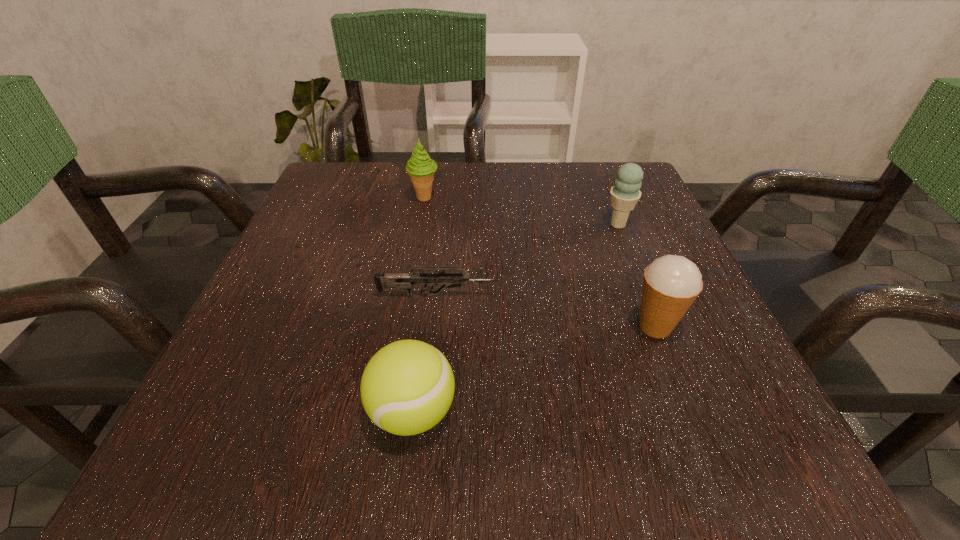
Where is `unoccupied position between the fourth tallest object and the nearest icecream`? This screenshot has height=540, width=960. unoccupied position between the fourth tallest object and the nearest icecream is located at coordinates (534, 369).

Identify the location of vacant point located between the fourth farthest object and the second farthest object. (636, 275).

Find the location of a particular element. Image resolution: width=960 pixels, height=540 pixels. object that stands as the fourth closest to the tennis ball is located at coordinates pos(626,193).

I want to click on object that is the second closest one to the second farthest object, so click(404, 281).

Point out which icecream is positioned as the second nearest to the farthest object. Please provide its 2D coordinates. Your answer should be formatted as a tuple, i.e. [(x, y)], where the tuple contains the x and y coordinates of a point satisfying the conditions above.

[(671, 284)]

Locate which icecream is the second closest to the fourth tallest object. Please provide its 2D coordinates. Your answer should be formatted as a tuple, i.e. [(x, y)], where the tuple contains the x and y coordinates of a point satisfying the conditions above.

[(420, 167)]

Where is `free spot that satisfies the following two spatial constraints: 1. on the back side of the second farthest icecream; 2. on the right side of the second nearest object`? The height and width of the screenshot is (540, 960). free spot that satisfies the following two spatial constraints: 1. on the back side of the second farthest icecream; 2. on the right side of the second nearest object is located at coordinates (615, 225).

I want to click on vacant point that satisfies the following two spatial constraints: 1. on the back side of the nearest icecream; 2. on the right side of the second farthest object, so click(x=615, y=225).

This screenshot has height=540, width=960. I want to click on vacant area in the image that satisfies the following two spatial constraints: 1. on the back side of the second shortest object; 2. on the right side of the second farthest object, so click(x=437, y=225).

Where is `free location that satisfies the following two spatial constraints: 1. on the back side of the tennis ball; 2. on the right side of the fourth nearest object`? The height and width of the screenshot is (540, 960). free location that satisfies the following two spatial constraints: 1. on the back side of the tennis ball; 2. on the right side of the fourth nearest object is located at coordinates (437, 225).